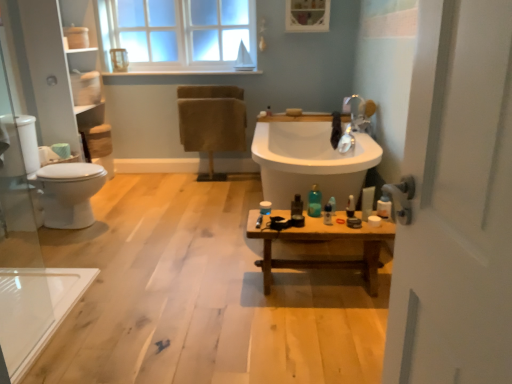
Identify the location of free spot above wooden bench at center (from a real-world perspective). (315, 216).